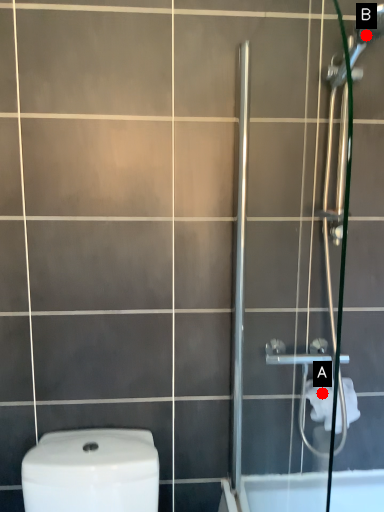
Question: Two points are circled on the image, labeled by A and B beside each circle. Which point is further to the camera?

Choices:
 (A) A is further
 (B) B is further

Answer: (A)